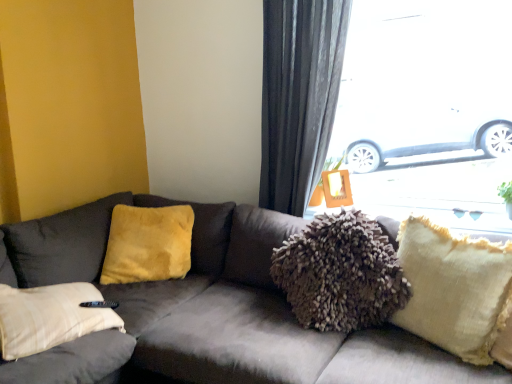
Question: From the image's perspective, does velvet gray couch at center appear lower than beige textured pillow at right, the second pillow when ordered from left to right?

Choices:
 (A) no
 (B) yes

Answer: (B)

Question: Does velvet gray couch at center come in front of beige textured pillow at right, the second pillow when ordered from left to right?

Choices:
 (A) no
 (B) yes

Answer: (B)

Question: Can you confirm if velvet gray couch at center is positioned to the right of beige textured pillow at right, which appears as the second pillow when viewed from the back?

Choices:
 (A) no
 (B) yes

Answer: (A)

Question: From a real-world perspective, is velvet gray couch at center located beneath beige textured pillow at right, which appears as the second pillow when viewed from the back?

Choices:
 (A) no
 (B) yes

Answer: (B)

Question: From a real-world perspective, is velvet gray couch at center located higher than beige textured pillow at right, the second pillow when ordered from left to right?

Choices:
 (A) no
 (B) yes

Answer: (A)

Question: From a real-world perspective, is beige textured pillow at right, which appears as the second pillow when viewed from the back, above or below transparent glass window at upper right?

Choices:
 (A) below
 (B) above

Answer: (A)

Question: Is point (480, 362) closer or farther from the camera than point (498, 81)?

Choices:
 (A) closer
 (B) farther

Answer: (A)

Question: Would you say beige textured pillow at right, which is the first pillow from right to left, is inside or outside transparent glass window at upper right?

Choices:
 (A) inside
 (B) outside

Answer: (B)

Question: In the image, is beige textured pillow at right, which is the first pillow from right to left, positioned in front of or behind transparent glass window at upper right?

Choices:
 (A) front
 (B) behind

Answer: (A)

Question: Does point (287, 120) appear closer or farther from the camera than point (482, 6)?

Choices:
 (A) closer
 (B) farther

Answer: (B)

Question: From a real-world perspective, is dark gray fabric curtain at upper right above or below transparent glass window at upper right?

Choices:
 (A) above
 (B) below

Answer: (B)

Question: In terms of size, does dark gray fabric curtain at upper right appear bigger or smaller than transparent glass window at upper right?

Choices:
 (A) big
 (B) small

Answer: (B)

Question: Is dark gray fabric curtain at upper right wider or thinner than transparent glass window at upper right?

Choices:
 (A) thin
 (B) wide

Answer: (A)

Question: Considering the positions of velvet gray couch at center and beige textured pillow at right, positioned as the 1th pillow in front-to-back order, in the image, is velvet gray couch at center wider or thinner than beige textured pillow at right, positioned as the 1th pillow in front-to-back order,?

Choices:
 (A) wide
 (B) thin

Answer: (A)

Question: Based on their sizes in the image, would you say velvet gray couch at center is bigger or smaller than beige textured pillow at right, which appears as the second pillow when viewed from the back?

Choices:
 (A) big
 (B) small

Answer: (A)